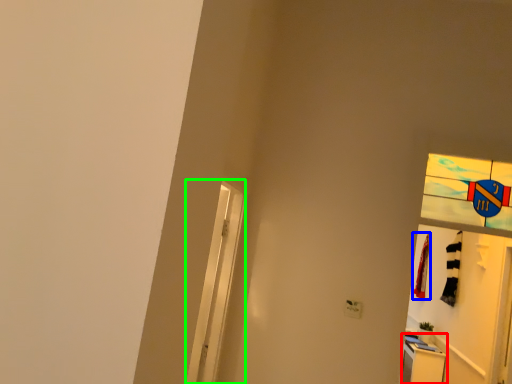
Question: Considering the real-world distances, which object is closest to dresser (highlighted by a red box)? laundry (highlighted by a blue box) or screen door (highlighted by a green box).

Choices:
 (A) laundry
 (B) screen door

Answer: (A)